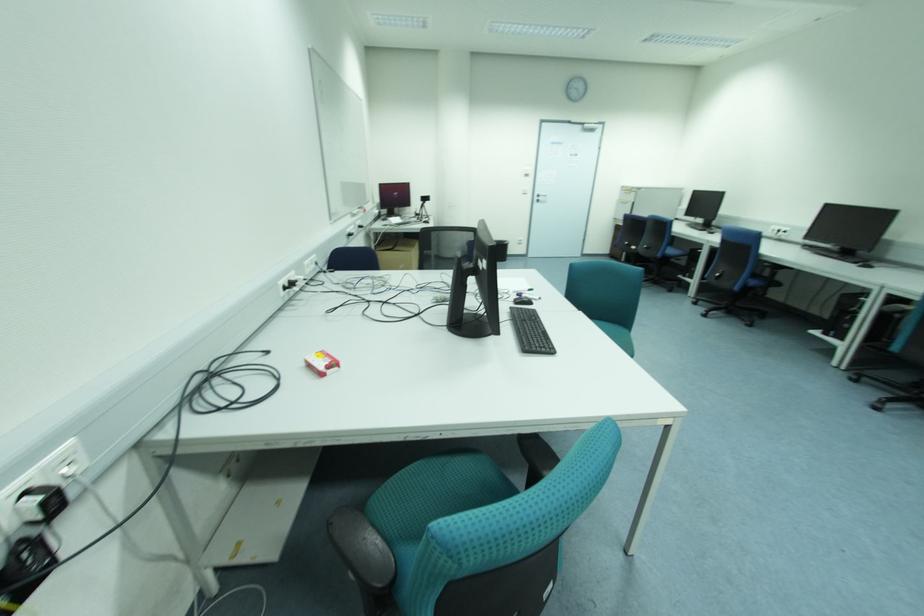
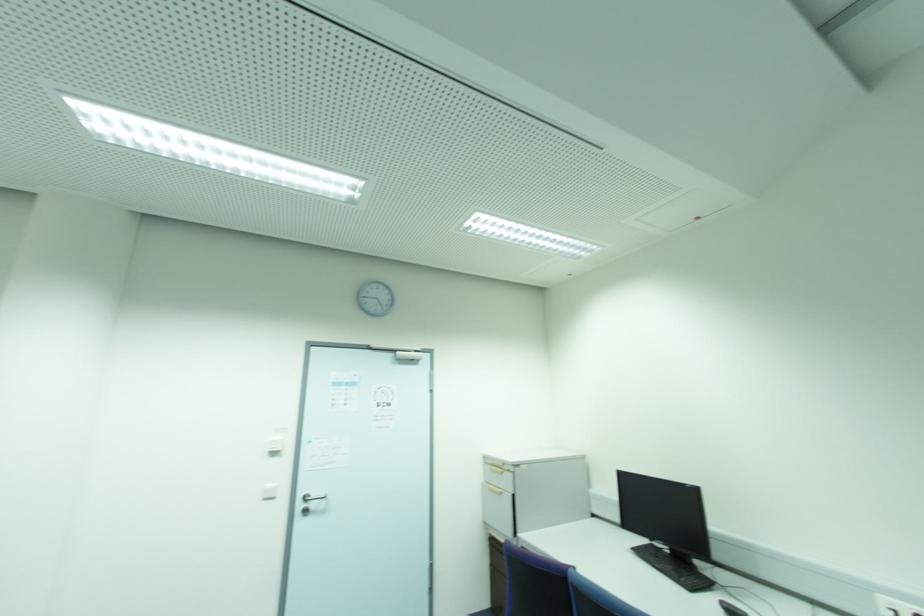
Locate, in the second image, the point that corresponds to the point at 538,196 in the first image.

(306, 500)